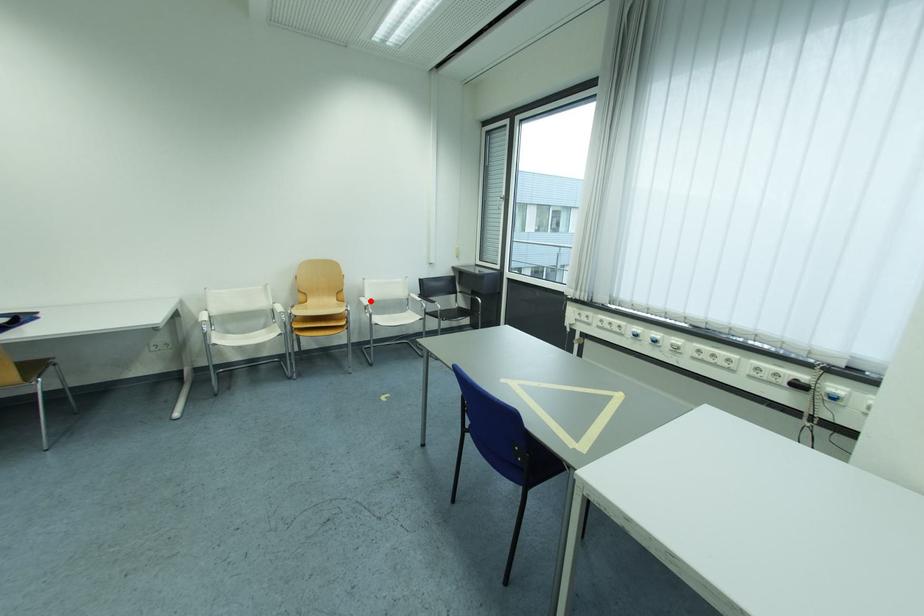
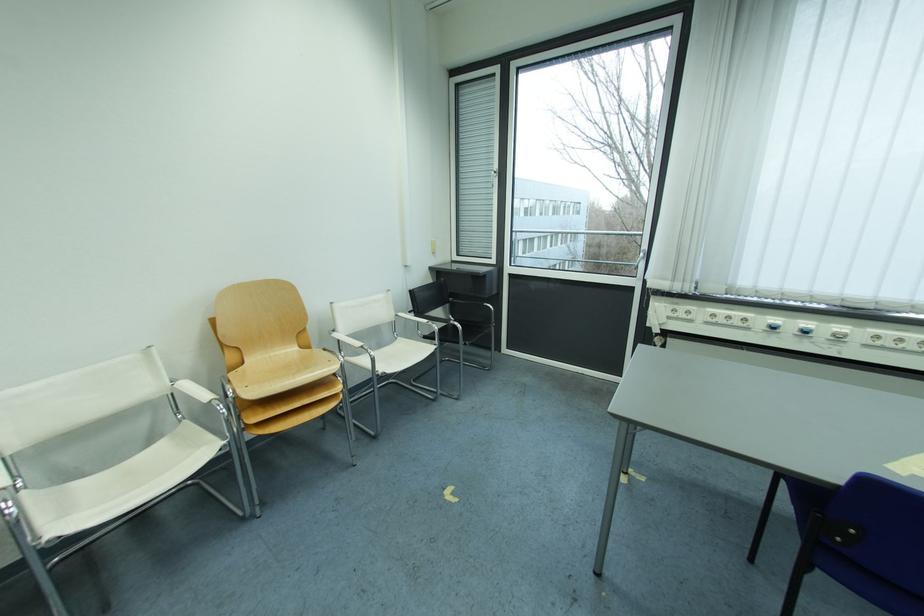
Question: I am providing you with two images of the same scene from different viewpoints. Given a red point in image1, look at the same physical point in image2. Is it:

Choices:
 (A) Closer to the viewpoint
 (B) Farther from the viewpoint

Answer: (B)